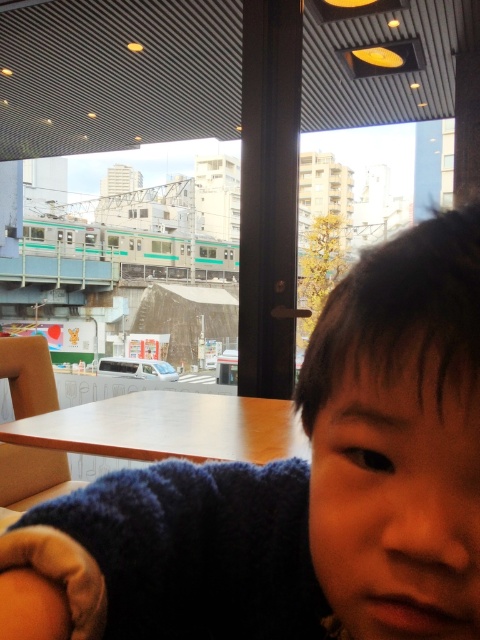
Question: Is dark blue sweater at center positioned at the back of wooden table at center?

Choices:
 (A) no
 (B) yes

Answer: (A)

Question: Is dark blue sweater at center positioned in front of wooden table at center?

Choices:
 (A) yes
 (B) no

Answer: (A)

Question: Which object is farther from the camera taking this photo?

Choices:
 (A) wooden table at center
 (B) dark blue sweater at center

Answer: (A)

Question: Considering the relative positions of dark blue sweater at center and wooden table at center in the image provided, where is dark blue sweater at center located with respect to wooden table at center?

Choices:
 (A) left
 (B) right

Answer: (B)

Question: Which object appears farthest from the camera in this image?

Choices:
 (A) dark blue sweater at center
 (B) wooden table at center

Answer: (B)

Question: Among these points, which one is nearest to the camera?

Choices:
 (A) (59, 436)
 (B) (255, 604)

Answer: (B)